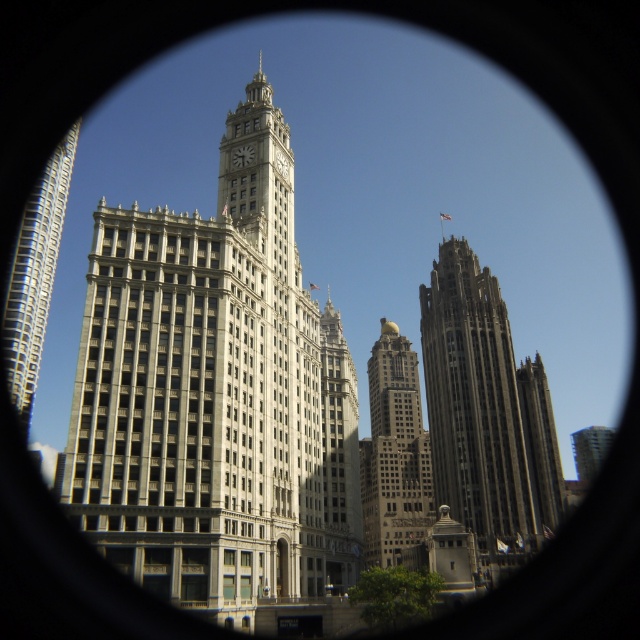
You are an architect analyzing the layout of a city skyline. You observe the dark gray stone tower at right and the gold polished dome at center. Based on their positions, which one is located to the east if the sun is setting in the west?

The dark gray stone tower at right is to the right of the gold polished dome at center. Since the sun is setting in the west, shadows would be cast to the east. If the dark gray stone tower at right is casting a shadow over the gold polished dome at center, it would mean the tower is to the west, making the gold polished dome at center located to the east. However, without specific shadow information, we can only state their relative positions as described.

You are an architect analyzing the buildings through the circular lens. Which of the two buildings, the dark gray stone tower at right or the silver metallic skyscraper at left, is taller?

The dark gray stone tower at right is taller than the silver metallic skyscraper at left according to the description provided.